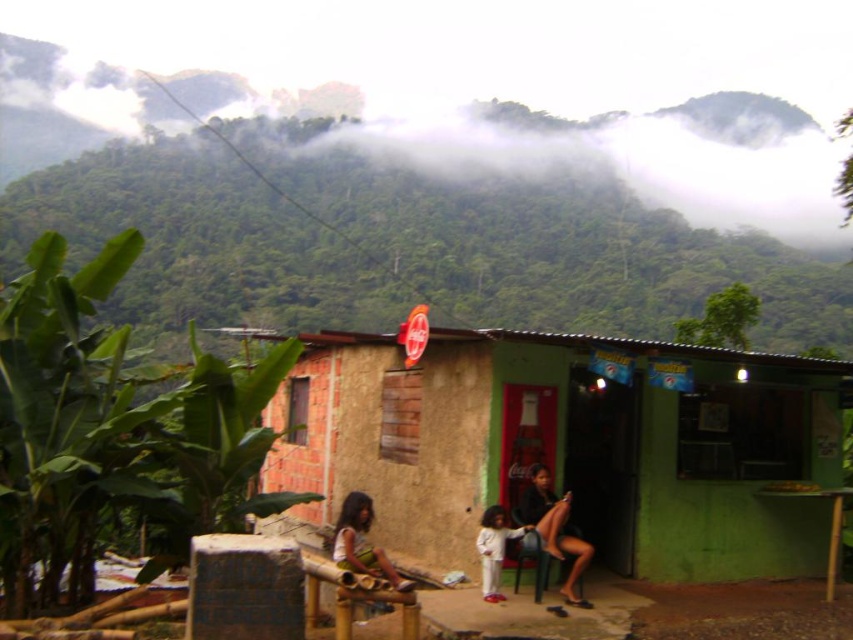
Between matte black dress at center and white matte dress at center, which one has less height?

white matte dress at center is shorter.

Does point (572, 604) come in front of point (476, 548)?

Yes, it is.

Identify the location of matte black dress at center. This screenshot has height=640, width=853. (554, 529).

What do you see at coordinates (363, 541) in the screenshot? I see `light brown wooden bench at lower center` at bounding box center [363, 541].

Does point (387, 570) come closer to viewer compared to point (482, 593)?

Yes, point (387, 570) is closer to viewer.

The image size is (853, 640). I want to click on light brown wooden bench at lower center, so pyautogui.click(x=363, y=541).

At what (x,y) coordinates should I click in order to perform the action: click on light brown wooden bench at lower center. Please return your answer as a coordinate pair (x, y). This screenshot has height=640, width=853. Looking at the image, I should click on (363, 541).

Based on the photo, can you confirm if green corrugated metal hut at center is positioned to the right of matte black dress at center?

Yes, green corrugated metal hut at center is to the right of matte black dress at center.

In the scene shown: Is green corrugated metal hut at center wider than matte black dress at center?

Incorrect, green corrugated metal hut at center's width does not surpass matte black dress at center's.

Identify the location of green corrugated metal hut at center. (569, 444).